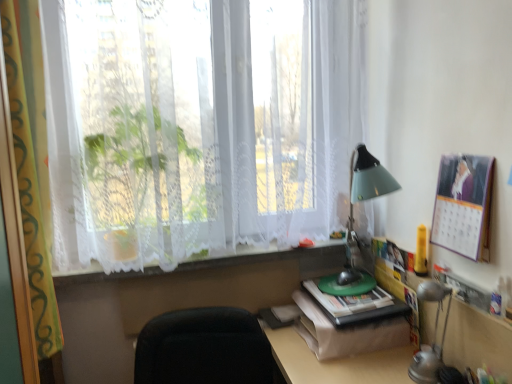
Question: Choose the correct answer: Is white lace curtain at left inside white lace curtains at upper center or outside it?

Choices:
 (A) inside
 (B) outside

Answer: (B)

Question: Looking at their shapes, would you say white lace curtain at left is wider or thinner than white lace curtains at upper center?

Choices:
 (A) thin
 (B) wide

Answer: (A)

Question: Considering the real-world distances, which object is closest to the metallic silver table lamp at lower right?

Choices:
 (A) green matte book at bottom right
 (B) yellow matte candle at right
 (C) green plastic desk at lower right
 (D) white lace curtain at left
 (E) white lace at center

Answer: (B)

Question: Which is nearer to the white lace curtain at left?

Choices:
 (A) white lace curtains at upper center
 (B) white lace at center
 (C) yellow matte candle at right
 (D) matte paper calendar at upper right
 (E) metallic silver table lamp at lower right

Answer: (A)